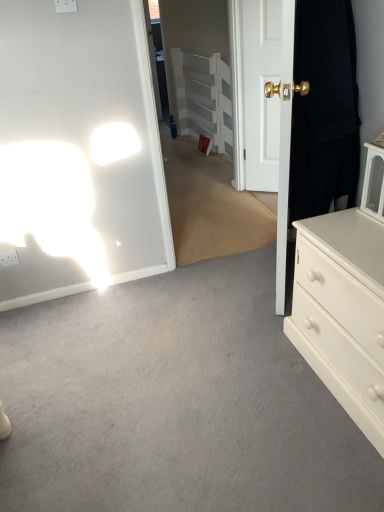
Question: Is white matte chest of drawers at right completely or partially inside white glossy door at center, arranged as the first door when viewed from the back?

Choices:
 (A) yes
 (B) no

Answer: (B)

Question: Is white glossy door at center, arranged as the 2th door when viewed from the front, aimed at white matte chest of drawers at right?

Choices:
 (A) no
 (B) yes

Answer: (A)

Question: Can you confirm if white glossy door at center, arranged as the first door when viewed from the back, is positioned to the left of white matte chest of drawers at right?

Choices:
 (A) yes
 (B) no

Answer: (A)

Question: Is white glossy door at center, arranged as the first door when viewed from the back, positioned far away from white matte chest of drawers at right?

Choices:
 (A) yes
 (B) no

Answer: (A)

Question: Is white glossy door at center, arranged as the 2th door when viewed from the front, further to camera compared to white matte chest of drawers at right?

Choices:
 (A) no
 (B) yes

Answer: (B)

Question: From a real-world perspective, is white glossy door at center, arranged as the 2th door when viewed from the front, below white matte chest of drawers at right?

Choices:
 (A) no
 (B) yes

Answer: (A)

Question: From a real-world perspective, is clear glass door at center over white painted wood armoire at center?

Choices:
 (A) yes
 (B) no

Answer: (A)

Question: Considering the relative sizes of clear glass door at center and white painted wood armoire at center in the image provided, is clear glass door at center wider than white painted wood armoire at center?

Choices:
 (A) yes
 (B) no

Answer: (B)

Question: Would you say white painted wood armoire at center is part of clear glass door at center's contents?

Choices:
 (A) no
 (B) yes

Answer: (A)

Question: From the image's perspective, is clear glass door at center below white painted wood armoire at center?

Choices:
 (A) yes
 (B) no

Answer: (A)

Question: From a real-world perspective, is clear glass door at center located beneath white painted wood armoire at center?

Choices:
 (A) yes
 (B) no

Answer: (B)

Question: Is clear glass door at center closer to the viewer compared to white painted wood armoire at center?

Choices:
 (A) no
 (B) yes

Answer: (B)

Question: Is black fabric door at right, acting as the first door starting from the front, positioned far away from clear glass door at center?

Choices:
 (A) yes
 (B) no

Answer: (A)